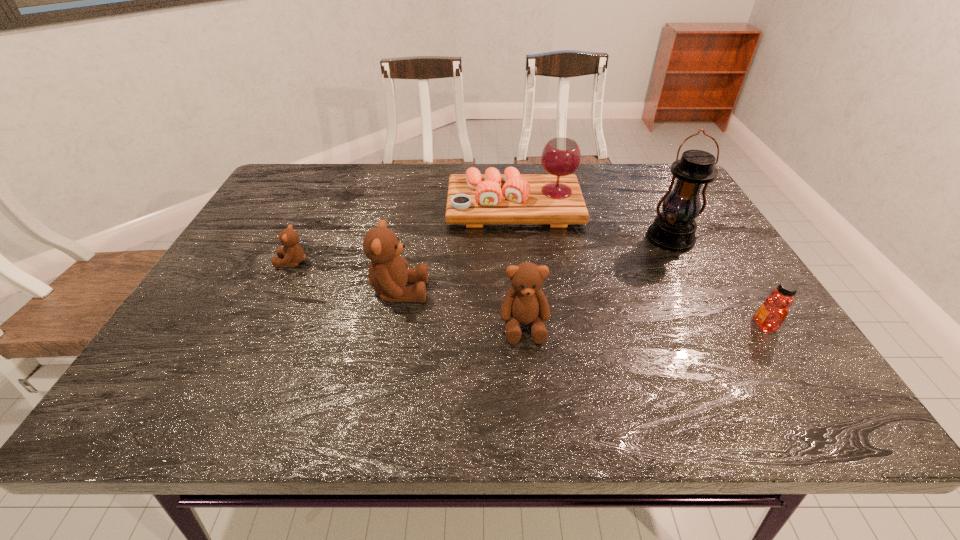
Locate an element on the screen. The height and width of the screenshot is (540, 960). free space that is in between the fifth object from right to left and the shortest teddy bear is located at coordinates (346, 277).

In order to click on vacant space in between the leftmost object and the tallest object in this screenshot , I will do `click(482, 251)`.

Locate which object is the third closest to the honey. Please provide its 2D coordinates. Your answer should be formatted as a tuple, i.e. [(x, y)], where the tuple contains the x and y coordinates of a point satisfying the conditions above.

[(525, 303)]

At what (x,y) coordinates should I click in order to perform the action: click on object that is the closest to the platter. Please return your answer as a coordinate pair (x, y). Looking at the image, I should click on (674, 229).

At what (x,y) coordinates should I click in order to perform the action: click on teddy bear that is the second nearest to the lantern. Please return your answer as a coordinate pair (x, y). The image size is (960, 540). Looking at the image, I should click on (388, 276).

The width and height of the screenshot is (960, 540). In order to click on teddy bear that stands as the third closest to the lantern in this screenshot , I will do `click(292, 254)`.

The image size is (960, 540). I want to click on vacant region that satisfies the following two spatial constraints: 1. above the tallest object, indicating its light source; 2. on the face of the farthest teddy bear, so click(x=684, y=262).